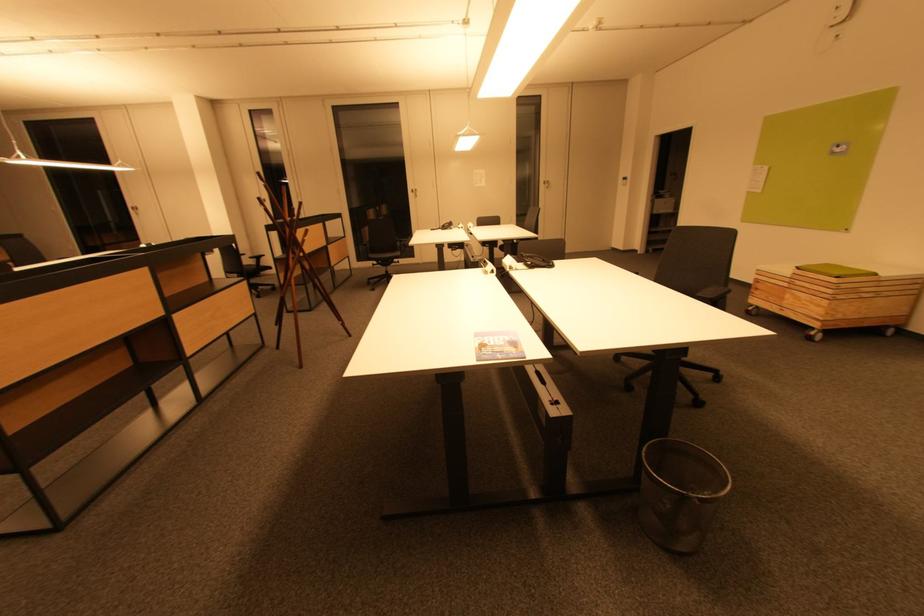
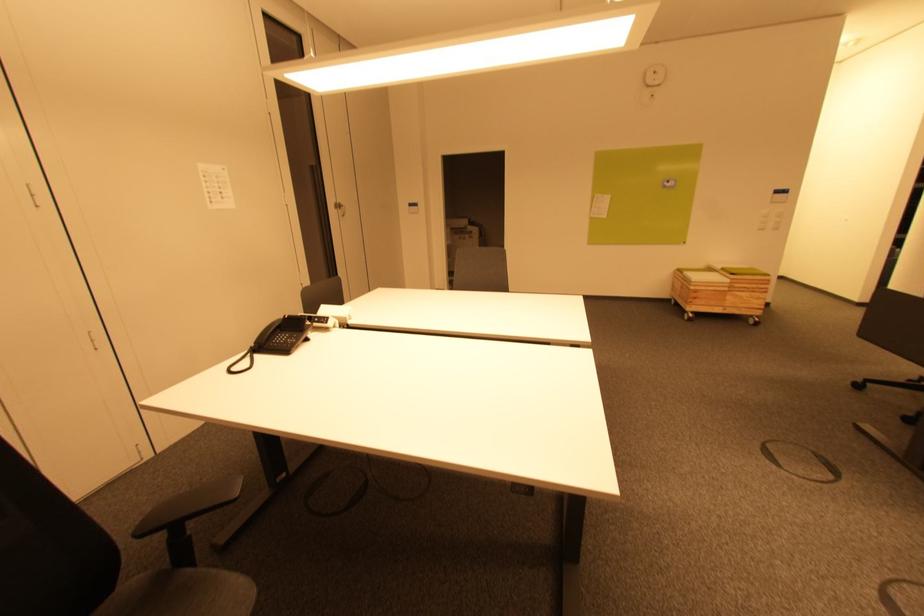
The point at (816,305) is marked in the first image. Where is the corresponding point in the second image?

(756, 300)